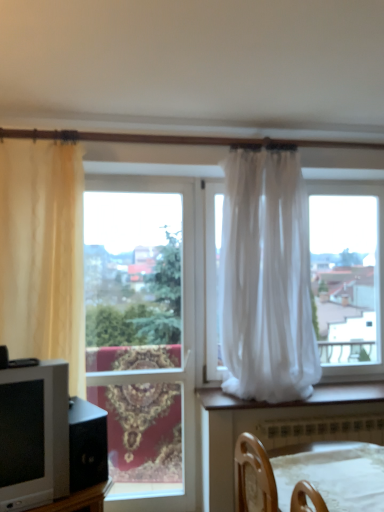
Image resolution: width=384 pixels, height=512 pixels. I want to click on matte gray tv at left, so click(46, 437).

The height and width of the screenshot is (512, 384). Describe the element at coordinates (142, 335) in the screenshot. I see `clear glass window at center` at that location.

This screenshot has width=384, height=512. Describe the element at coordinates (266, 279) in the screenshot. I see `white sheer curtain at center, which ranks as the 1th curtain in right-to-left order` at that location.

What is the approximate width of white sheer curtain at center, the second curtain viewed from the left?

19.29 inches.

I want to click on beige sheer curtain at left, which is counted as the 1th curtain, starting from the left, so click(43, 254).

From the image's perspective, is wooden chair at lower center located beneath beige sheer curtain at left, acting as the 2th curtain starting from the right?

Yes, from the image's perspective, wooden chair at lower center is beneath beige sheer curtain at left, acting as the 2th curtain starting from the right.

Considering the relative sizes of wooden chair at lower center and beige sheer curtain at left, which is counted as the 1th curtain, starting from the left, in the image provided, is wooden chair at lower center thinner than beige sheer curtain at left, which is counted as the 1th curtain, starting from the left,?

In fact, wooden chair at lower center might be wider than beige sheer curtain at left, which is counted as the 1th curtain, starting from the left.

From the picture: Does wooden chair at lower center come in front of beige sheer curtain at left, acting as the 2th curtain starting from the right?

Yes, it is in front of beige sheer curtain at left, acting as the 2th curtain starting from the right.

Where is `furniture below the beige sheer curtain at left, acting as the 2th curtain starting from the right (from the image's perspective)`? This screenshot has height=512, width=384. furniture below the beige sheer curtain at left, acting as the 2th curtain starting from the right (from the image's perspective) is located at coordinates (281, 428).

Would you say beige sheer curtain at left, which is counted as the 1th curtain, starting from the left, is to the left or to the right of wooden chair at lower center in the picture?

Based on their positions, beige sheer curtain at left, which is counted as the 1th curtain, starting from the left, is located to the left of wooden chair at lower center.

Is beige sheer curtain at left, acting as the 2th curtain starting from the right, next to wooden chair at lower center and touching it?

No, beige sheer curtain at left, acting as the 2th curtain starting from the right, is not making contact with wooden chair at lower center.

From a real-world perspective, which object stands above the other?

white sheer curtain at center, which ranks as the 1th curtain in right-to-left order, from a real-world perspective.

Is white sheer curtain at center, the second curtain viewed from the left, placed right next to beige sheer curtain at left, acting as the 2th curtain starting from the right?

white sheer curtain at center, the second curtain viewed from the left, and beige sheer curtain at left, acting as the 2th curtain starting from the right, are clearly separated.

Which is more to the left, white sheer curtain at center, the second curtain viewed from the left, or beige sheer curtain at left, acting as the 2th curtain starting from the right?

beige sheer curtain at left, acting as the 2th curtain starting from the right, is more to the left.

Can you tell me how much beige sheer curtain at left, which is counted as the 1th curtain, starting from the left, and matte gray tv at left differ in facing direction?

beige sheer curtain at left, which is counted as the 1th curtain, starting from the left, and matte gray tv at left are facing 31.4 degrees away from each other.

Considering the positions of objects beige sheer curtain at left, which is counted as the 1th curtain, starting from the left, and matte gray tv at left in the image provided, who is more to the left, beige sheer curtain at left, which is counted as the 1th curtain, starting from the left, or matte gray tv at left?

From the viewer's perspective, beige sheer curtain at left, which is counted as the 1th curtain, starting from the left, appears more on the left side.

Can you confirm if beige sheer curtain at left, which is counted as the 1th curtain, starting from the left, is thinner than matte gray tv at left?

No, beige sheer curtain at left, which is counted as the 1th curtain, starting from the left, is not thinner than matte gray tv at left.

Which is behind, beige sheer curtain at left, which is counted as the 1th curtain, starting from the left, or matte gray tv at left?

beige sheer curtain at left, which is counted as the 1th curtain, starting from the left, is further from the camera.

You are a GUI agent. You are given a task and a screenshot of the screen. Output one action in this format:
    pyautogui.click(x=<x>, y=<y>)
    Task: Click on the window that appears on the right of beige sheer curtain at left, acting as the 2th curtain starting from the right
    This screenshot has height=512, width=384.
    Given the screenshot: What is the action you would take?
    pyautogui.click(x=142, y=335)

Who is more distant, beige sheer curtain at left, which is counted as the 1th curtain, starting from the left, or clear glass window at center?

clear glass window at center is behind.

From a real-world perspective, between beige sheer curtain at left, which is counted as the 1th curtain, starting from the left, and clear glass window at center, who is vertically higher?

beige sheer curtain at left, which is counted as the 1th curtain, starting from the left.

Image resolution: width=384 pixels, height=512 pixels. In order to click on furniture in front of the matte gray tv at left in this screenshot , I will do `click(281, 428)`.

Is matte gray tv at left thinner than wooden chair at lower center?

Yes.

Considering the sizes of objects matte gray tv at left and wooden chair at lower center in the image provided, who is shorter, matte gray tv at left or wooden chair at lower center?

With less height is wooden chair at lower center.

Based on the photo, how different are the orientations of white sheer curtain at center, the second curtain viewed from the left, and wooden chair at lower center in degrees?

There is a 99.2-degree angle between the facing directions of white sheer curtain at center, the second curtain viewed from the left, and wooden chair at lower center.

Is white sheer curtain at center, which ranks as the 1th curtain in right-to-left order, at the right side of wooden chair at lower center?

In fact, white sheer curtain at center, which ranks as the 1th curtain in right-to-left order, is to the left of wooden chair at lower center.

From the image's perspective, does white sheer curtain at center, which ranks as the 1th curtain in right-to-left order, appear lower than wooden chair at lower center?

No, from the image's perspective, white sheer curtain at center, which ranks as the 1th curtain in right-to-left order, is not beneath wooden chair at lower center.

Can you confirm if white sheer curtain at center, the second curtain viewed from the left, is wider than wooden chair at lower center?

No, white sheer curtain at center, the second curtain viewed from the left, is not wider than wooden chair at lower center.

Locate an element on the screen. The width and height of the screenshot is (384, 512). the 1st curtain directly above the wooden chair at lower center (from a real-world perspective) is located at coordinates (43, 254).

I want to click on furniture on the right of beige sheer curtain at left, which is counted as the 1th curtain, starting from the left, so click(281, 428).

Which object lies nearer to the anchor point beige sheer curtain at left, which is counted as the 1th curtain, starting from the left, white sheer curtain at center, which ranks as the 1th curtain in right-to-left order, or wooden chair at lower center?

white sheer curtain at center, which ranks as the 1th curtain in right-to-left order, is positioned closer to the anchor beige sheer curtain at left, which is counted as the 1th curtain, starting from the left.

From the image, which object appears to be nearer to white plastic radiator at lower center, white sheer curtain at center, the second curtain viewed from the left, or beige sheer curtain at left, which is counted as the 1th curtain, starting from the left?

white sheer curtain at center, the second curtain viewed from the left, lies closer to white plastic radiator at lower center than the other object.

When comparing their distances from clear glass window at center, does wooden chair at lower center or white plastic radiator at lower center seem closer?

The object closer to clear glass window at center is wooden chair at lower center.

Based on their spatial positions, is wooden chair at lower center or beige sheer curtain at left, acting as the 2th curtain starting from the right, closer to white plastic radiator at lower center?

→ wooden chair at lower center is positioned closer to the anchor white plastic radiator at lower center.

Estimate the real-world distances between objects in this image. Which object is closer to white plastic radiator at lower center, clear glass window at center or beige sheer curtain at left, which is counted as the 1th curtain, starting from the left?

The object closer to white plastic radiator at lower center is clear glass window at center.

Estimate the real-world distances between objects in this image. Which object is further from matte gray tv at left, white sheer curtain at center, which ranks as the 1th curtain in right-to-left order, or beige sheer curtain at left, acting as the 2th curtain starting from the right?

white sheer curtain at center, which ranks as the 1th curtain in right-to-left order, lies further to matte gray tv at left than the other object.

Looking at the image, which one is located further to beige sheer curtain at left, acting as the 2th curtain starting from the right, matte gray tv at left or clear glass window at center?

Among the two, clear glass window at center is located further to beige sheer curtain at left, acting as the 2th curtain starting from the right.

Consider the image. When comparing their distances from white sheer curtain at center, the second curtain viewed from the left, does beige sheer curtain at left, which is counted as the 1th curtain, starting from the left, or white plastic radiator at lower center seem further?

beige sheer curtain at left, which is counted as the 1th curtain, starting from the left.

Locate an element on the screen. The image size is (384, 512). window between matte gray tv at left and white plastic radiator at lower center in the horizontal direction is located at coordinates (142, 335).

Where is `curtain between clear glass window at center and white plastic radiator at lower center in the horizontal direction`? curtain between clear glass window at center and white plastic radiator at lower center in the horizontal direction is located at coordinates pos(266,279).

I want to click on furniture located between matte gray tv at left and white plastic radiator at lower center in the left-right direction, so click(281, 428).

This screenshot has height=512, width=384. I want to click on curtain between matte gray tv at left and white plastic radiator at lower center in the horizontal direction, so click(266, 279).